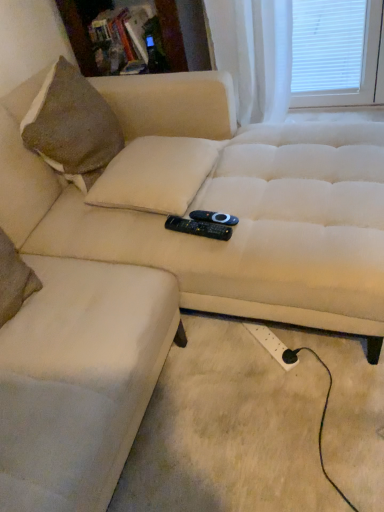
You are a GUI agent. You are given a task and a screenshot of the screen. Output one action in this format:
    pyautogui.click(x=<x>, y=<y>)
    Task: Click on the vacant space in front of white plastic extension cord at lower right
    The image size is (384, 512).
    Given the screenshot: What is the action you would take?
    pyautogui.click(x=284, y=389)